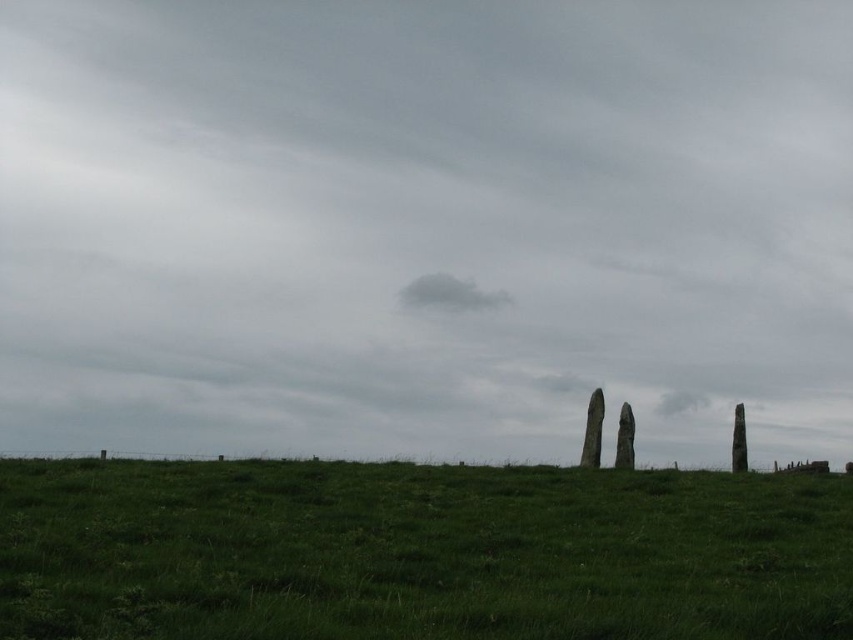
Does point (544, 56) lie behind point (444, 305)?

Yes, it is.

Can you confirm if gray cloudy sky at upper center is smaller than gray cotton cloud at center?

Actually, gray cloudy sky at upper center might be larger than gray cotton cloud at center.

Between point (515, 412) and point (427, 278), which one is positioned in front?

Point (427, 278) is more forward.

The width and height of the screenshot is (853, 640). I want to click on gray cloudy sky at upper center, so click(x=424, y=225).

Can you confirm if gray cloudy sky at upper center is positioned above green grassy field at lower center?

Indeed, gray cloudy sky at upper center is positioned over green grassy field at lower center.

Is gray cloudy sky at upper center taller than green grassy field at lower center?

Indeed, gray cloudy sky at upper center has a greater height compared to green grassy field at lower center.

Between point (450, 164) and point (196, 598), which one is positioned behind?

The point (450, 164) is more distant.

At what (x,y) coordinates should I click in order to perform the action: click on gray cloudy sky at upper center. Please return your answer as a coordinate pair (x, y). Looking at the image, I should click on (424, 225).

Does green grassy field at lower center lie behind gray cotton cloud at center?

No, green grassy field at lower center is closer to the viewer.

Locate an element on the screen. green grassy field at lower center is located at coordinates tap(418, 552).